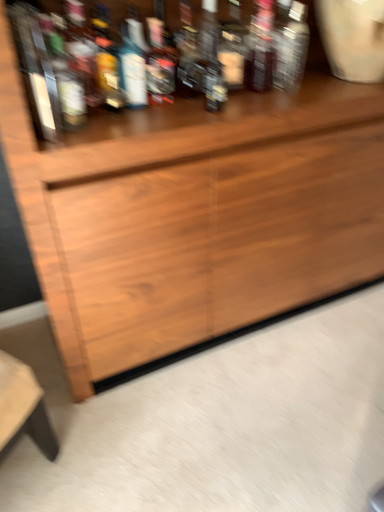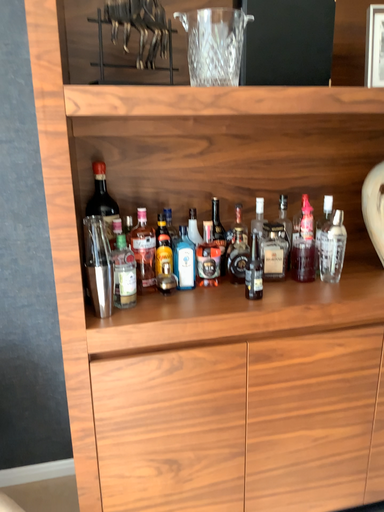
Question: How did the camera likely rotate when shooting the video?

Choices:
 (A) rotated downward
 (B) rotated upward

Answer: (B)